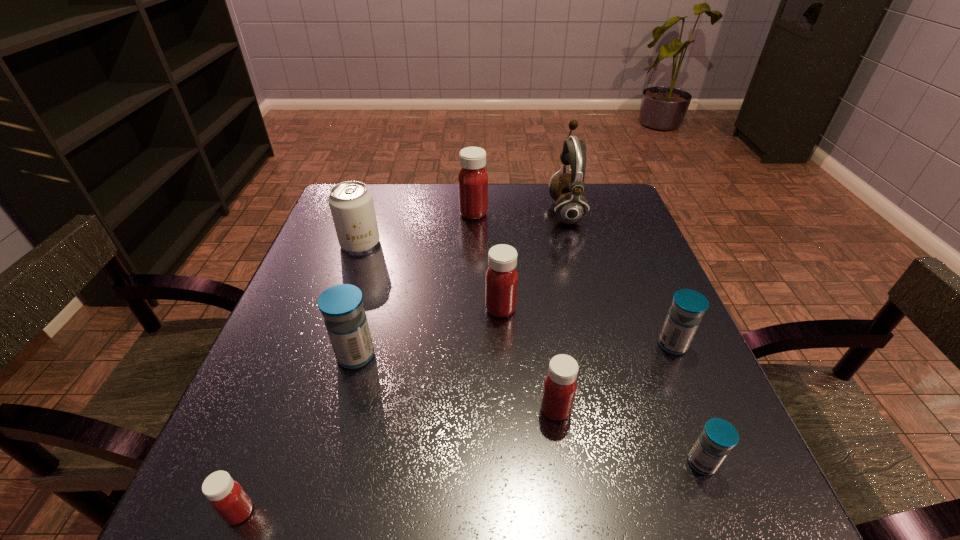
You are a GUI agent. You are given a task and a screenshot of the screen. Output one action in this format:
    pyautogui.click(x=<x>, y=<y>)
    Task: Click on the free space located 0.250m on the back of the third farthest object
    
    Given the screenshot: What is the action you would take?
    pyautogui.click(x=380, y=184)

Find the location of a particular element. blank space located 0.280m on the right of the biggest blue medicine is located at coordinates (523, 356).

You are a GUI agent. You are given a task and a screenshot of the screen. Output one action in this format:
    pyautogui.click(x=<x>, y=<y>)
    Task: Click on the blank area located 0.230m on the left of the third smallest red medicine
    
    Given the screenshot: What is the action you would take?
    pyautogui.click(x=376, y=309)

Locate an element on the screen. The height and width of the screenshot is (540, 960). vacant space situated 0.190m on the back of the second biggest blue medicine is located at coordinates (641, 272).

You are a GUI agent. You are given a task and a screenshot of the screen. Output one action in this format:
    pyautogui.click(x=<x>, y=<y>)
    Task: Click on the free space located 0.250m on the left of the third farthest red medicine
    The height and width of the screenshot is (540, 960).
    Given the screenshot: What is the action you would take?
    pyautogui.click(x=394, y=410)

The image size is (960, 540). Identify the location of free spot located on the left of the second nearest object. (636, 463).

The height and width of the screenshot is (540, 960). I want to click on vacant point located 0.170m on the right of the leftmost red medicine, so click(373, 512).

I want to click on earphone at the far edge, so click(566, 189).

The height and width of the screenshot is (540, 960). What are the coordinates of `medicine that is at the far edge` in the screenshot? It's located at (472, 180).

You are a GUI agent. You are given a task and a screenshot of the screen. Output one action in this format:
    pyautogui.click(x=<x>, y=<y>)
    Task: Click on the soda can located in the left edge section of the desktop
    Image resolution: width=960 pixels, height=540 pixels.
    Given the screenshot: What is the action you would take?
    pyautogui.click(x=351, y=203)